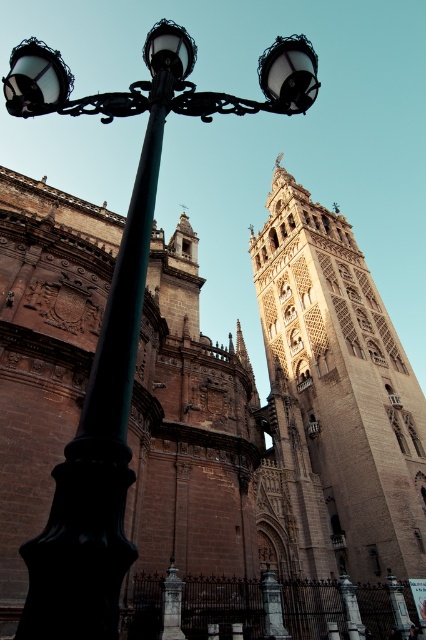
Is light brown stone tower at upper right closer to camera compared to black metal pole at left?

No.

Is light brown stone tower at upper right above black metal pole at left?

Yes, light brown stone tower at upper right is above black metal pole at left.

Describe the element at coordinates (336, 397) in the screenshot. I see `light brown stone tower at upper right` at that location.

Locate an element on the screen. Image resolution: width=426 pixels, height=640 pixels. light brown stone tower at upper right is located at coordinates (336, 397).

Is black metal pole at left taller than matte black streetlamp at upper left?

No, black metal pole at left is not taller than matte black streetlamp at upper left.

Between black metal pole at left and matte black streetlamp at upper left, which one has more height?

With more height is matte black streetlamp at upper left.

Who is more forward, [138,268] or [184,106]?

Point [138,268] is in front.

Locate an element on the screen. This screenshot has height=640, width=426. black metal pole at left is located at coordinates (98, 442).

Is light brown stone tower at upper right thinner than matte black streetlamp at upper left?

Indeed, light brown stone tower at upper right has a lesser width compared to matte black streetlamp at upper left.

Between light brown stone tower at upper right and matte black streetlamp at upper left, which one is positioned higher?

matte black streetlamp at upper left is higher up.

Is point (380, 358) positioned after point (241, 102)?

Yes, it is.

Where is `light brown stone tower at upper right`? The image size is (426, 640). light brown stone tower at upper right is located at coordinates (336, 397).